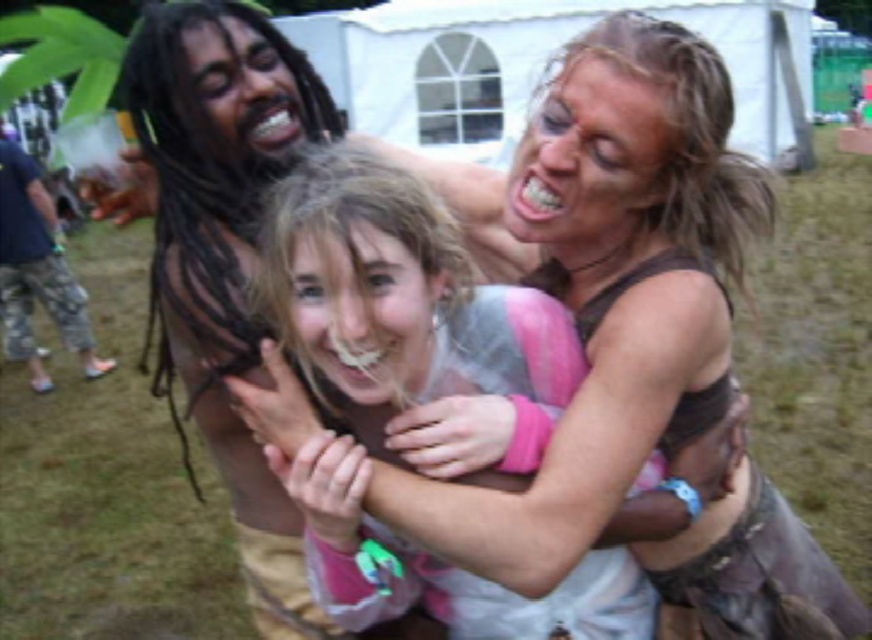
You are a photographer trying to capture a candid shot of the smooth skin face at center and the blonde hair at upper right. Which one is positioned higher in the frame?

The blonde hair at upper right is located above the smooth skin face at center in the frame.